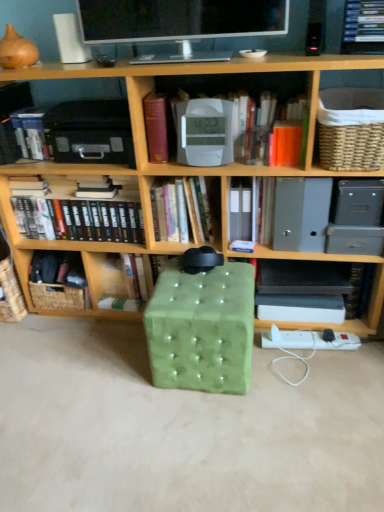
Describe the element at coordinates (181, 210) in the screenshot. I see `hardcover book at center, acting as the third book starting from the right` at that location.

Describe the element at coordinates (58, 281) in the screenshot. I see `woven brown basket at lower left, which is the second basket in front-to-back order` at that location.

The height and width of the screenshot is (512, 384). I want to click on matte black monitor at upper center, so [x=179, y=19].

What is the approximate height of hardcover books at center, which appears as the second book when viewed from the left?

It is 7.95 inches.

Where is `orange matte paper at upper right, arranged as the third paperback book when viewed from the left`? Image resolution: width=384 pixels, height=512 pixels. orange matte paper at upper right, arranged as the third paperback book when viewed from the left is located at coordinates click(x=285, y=144).

Identify the location of hardcover book at center, the 4th book from the left. The width and height of the screenshot is (384, 512). (181, 210).

Based on the photo, can you confirm if woven beige basket at upper right, which is the second basket in left-to-right order, is wider than black hardcover book at lower right, arranged as the 6th book when viewed from the left?

Correct, the width of woven beige basket at upper right, which is the second basket in left-to-right order, exceeds that of black hardcover book at lower right, arranged as the 6th book when viewed from the left.

Between woven beige basket at upper right, which ranks as the second basket in back-to-front order, and black hardcover book at lower right, arranged as the 1th book when viewed from the right, which one has larger size?

woven beige basket at upper right, which ranks as the second basket in back-to-front order, is bigger.

Is point (325, 167) closer to viewer compared to point (292, 311)?

Yes, it is.

From a real-world perspective, is woven beige basket at upper right, which is the second basket in left-to-right order, under black hardcover book at lower right, arranged as the 1th book when viewed from the right?

Actually, woven beige basket at upper right, which is the second basket in left-to-right order, is physically above black hardcover book at lower right, arranged as the 1th book when viewed from the right, in the real world.

Would you say woven beige basket at upper right, which ranks as the second basket in back-to-front order, is inside or outside hardcover book at center, which is the 4th book from right to left?

woven beige basket at upper right, which ranks as the second basket in back-to-front order, is outside hardcover book at center, which is the 4th book from right to left.

Considering the positions of objects woven beige basket at upper right, which is the second basket in left-to-right order, and hardcover book at center, which is the 4th book from right to left, in the image provided, who is more to the left, woven beige basket at upper right, which is the second basket in left-to-right order, or hardcover book at center, which is the 4th book from right to left,?

From the viewer's perspective, hardcover book at center, which is the 4th book from right to left, appears more on the left side.

Looking at this image, between woven beige basket at upper right, the second basket in the bottom-to-top sequence, and hardcover book at center, which is the 4th book from right to left, which one has more height?

Standing taller between the two is woven beige basket at upper right, the second basket in the bottom-to-top sequence.

From a real-world perspective, which is physically above, white paper at center, which is counted as the second paperback book, starting from the left, or black hardcover book at lower right, arranged as the 6th book when viewed from the left?

From a 3D spatial view, white paper at center, which is counted as the second paperback book, starting from the left, is above.

The image size is (384, 512). In order to click on paperback book that is the 1st object located in front of the black hardcover book at lower right, arranged as the 6th book when viewed from the left in this screenshot , I will do `click(240, 209)`.

Could you measure the distance between white paper at center, which is counted as the second paperback book, starting from the left, and black hardcover book at lower right, arranged as the 1th book when viewed from the right?

12.76 inches.

Is black hardcover book at lower right, arranged as the 1th book when viewed from the right, at the back of white paper at center, marked as the second paperback book in a right-to-left arrangement?

No, white paper at center, marked as the second paperback book in a right-to-left arrangement, is not facing away from black hardcover book at lower right, arranged as the 1th book when viewed from the right.

Is point (200, 7) positioned after point (209, 136)?

No, it is in front of (209, 136).

Is matte black monitor at upper center not near white plastic clock at center, the 2th book positioned from the right?

No.

Is matte black monitor at upper center thinner than white plastic clock at center, the 2th book positioned from the right?

No, matte black monitor at upper center is not thinner than white plastic clock at center, the 2th book positioned from the right.

How many degrees apart are the facing directions of black hardcover book at lower right, arranged as the 6th book when viewed from the left, and wooden bookshelf at center?

They differ by 0.621 degrees in their facing directions.

Can you confirm if black hardcover book at lower right, arranged as the 6th book when viewed from the left, is wider than wooden bookshelf at center?

No.

Who is bigger, black hardcover book at lower right, arranged as the 6th book when viewed from the left, or wooden bookshelf at center?

With larger size is wooden bookshelf at center.

Is woven brown basket at lower left, positioned as the 1th basket in back-to-front order, located within wooden bookshelf at center?

Yes, woven brown basket at lower left, positioned as the 1th basket in back-to-front order, is a part of wooden bookshelf at center.

Consider the image. From a real-world perspective, does wooden bookshelf at center sit lower than woven brown basket at lower left, the second basket in the right-to-left sequence?

No.

Which point is more distant from viewer, (94, 245) or (61, 283)?

The point (61, 283) is more distant.

Between wooden bookshelf at center and woven brown basket at lower left, which is the second basket in front-to-back order, which one appears on the right side from the viewer's perspective?

wooden bookshelf at center is more to the right.

From a real-world perspective, which is physically below, woven brown basket at lower left, the second basket in the right-to-left sequence, or wooden bookshelf at center?

woven brown basket at lower left, the second basket in the right-to-left sequence, from a real-world perspective.

Is woven brown basket at lower left, the 1th basket in the left-to-right sequence, with wooden bookshelf at center?

woven brown basket at lower left, the 1th basket in the left-to-right sequence, is not next to wooden bookshelf at center, and they're not touching.

Which is in front, woven brown basket at lower left, which ranks as the second basket in top-to-bottom order, or wooden bookshelf at center?

Positioned in front is wooden bookshelf at center.

Identify the location of the 4th book below the woven beige basket at upper right, which ranks as the first basket in front-to-back order (from the image's perspective). (307, 290).

At what (x,y) coordinates should I click in order to perform the action: click on basket on the right of hardcover book at center, which is the 4th book from right to left. Please return your answer as a coordinate pair (x, y). Looking at the image, I should click on click(x=351, y=129).

Considering their positions, is hardcover book at center, acting as the third book starting from the right, positioned further to woven brown basket at lower left, acting as the 1th basket starting from the bottom, than hardcover books at center, which appears as the second book when viewed from the left?

hardcover book at center, acting as the third book starting from the right, lies further to woven brown basket at lower left, acting as the 1th basket starting from the bottom, than the other object.

When comparing their distances from green velvet ottoman at center, does white paper at center, marked as the second paperback book in a right-to-left arrangement, or matte black monitor at upper center seem closer?

white paper at center, marked as the second paperback book in a right-to-left arrangement.

Considering their positions, is woven brown basket at lower left, the 1th basket in the left-to-right sequence, positioned closer to white paper at center, marked as the second paperback book in a right-to-left arrangement, than maroon leather book at upper center, the 1th paperback book in the left-to-right sequence?

maroon leather book at upper center, the 1th paperback book in the left-to-right sequence.

From the image, which object appears to be nearer to maroon leather book at upper center, marked as the third paperback book in a right-to-left arrangement, white paper at center, marked as the second paperback book in a right-to-left arrangement, or matte black monitor at upper center?

matte black monitor at upper center is closer to maroon leather book at upper center, marked as the third paperback book in a right-to-left arrangement.

From the image, which object appears to be nearer to woven beige basket at upper right, which is counted as the first basket, starting from the right, black hardcover book at lower right, arranged as the 1th book when viewed from the right, or green velvet ottoman at center?

Among the two, black hardcover book at lower right, arranged as the 1th book when viewed from the right, is located nearer to woven beige basket at upper right, which is counted as the first basket, starting from the right.

Estimate the real-world distances between objects in this image. Which object is further from green velvet ottoman at center, hardcover books at center, positioned as the fifth book in right-to-left order, or maroon leather book at upper center, marked as the third paperback book in a right-to-left arrangement?

maroon leather book at upper center, marked as the third paperback book in a right-to-left arrangement, lies further to green velvet ottoman at center than the other object.

Estimate the real-world distances between objects in this image. Which object is closer to white plastic clock at center, the 2th book positioned from the right, hardcover book at left, arranged as the 6th book when viewed from the right, or matte black monitor at upper center?

matte black monitor at upper center.

Looking at the image, which one is located closer to hardcover book at center, acting as the third book starting from the right, hardcover book at left, arranged as the 6th book when viewed from the right, or green velvet ottoman at center?

green velvet ottoman at center is closer to hardcover book at center, acting as the third book starting from the right.

The height and width of the screenshot is (512, 384). I want to click on book located between hardcover book at center, the 4th book from the left, and orange matte paper at upper right, arranged as the third paperback book when viewed from the left, in the left-right direction, so click(x=202, y=131).

Locate an element on the screen. shelf located between hardcover book at left, which is the 1th book in left-to-right order, and white plastic clock at center, the 2th book positioned from the right, in the left-right direction is located at coordinates (158, 164).

Find the location of a particular element. television between hardcover book at left, which is the 1th book in left-to-right order, and black hardcover book at lower right, arranged as the 1th book when viewed from the right is located at coordinates (x=179, y=19).

Find the location of a particular element. This screenshot has height=512, width=384. book situated between wooden bookshelf at center and orange matte paper at upper right, arranged as the third paperback book when viewed from the left, from left to right is located at coordinates (202, 131).